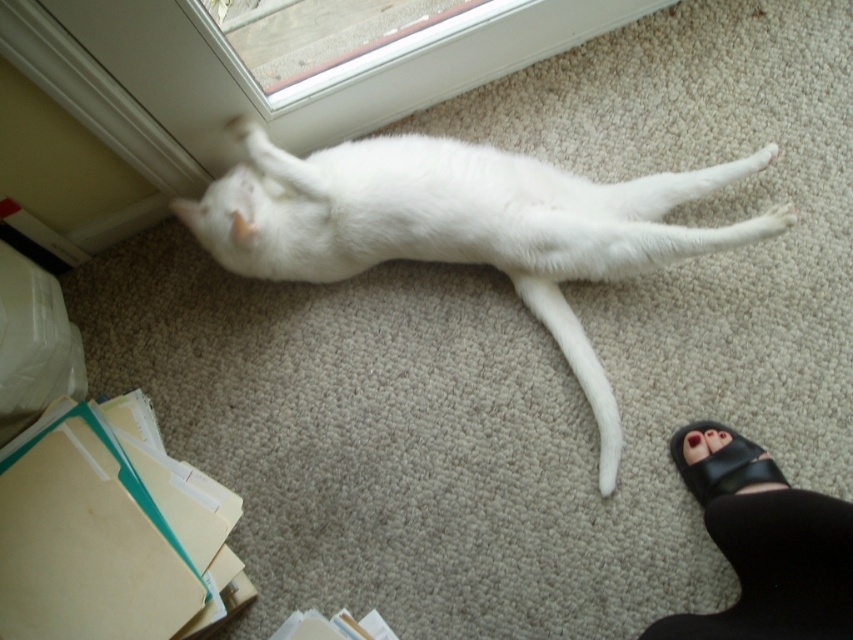
Is white fur cat at center smaller than black leather sandals at lower right?

No, white fur cat at center is not smaller than black leather sandals at lower right.

From the picture: Can you confirm if white fur cat at center is shorter than black leather sandals at lower right?

In fact, white fur cat at center may be taller than black leather sandals at lower right.

Is point (244, 216) behind point (778, 572)?

Yes.

Find the location of a particular element. The image size is (853, 640). white fur cat at center is located at coordinates (462, 227).

Between black leather sandals at lower right and black leather sandal at lower right, which one appears on the right side from the viewer's perspective?

From the viewer's perspective, black leather sandal at lower right appears more on the right side.

Does point (793, 538) come farther from viewer compared to point (706, 493)?

That is False.

Does point (689, 474) come behind point (715, 429)?

No.

At what (x,y) coordinates should I click in order to perform the action: click on black leather sandals at lower right. Please return your answer as a coordinate pair (x, y). Looking at the image, I should click on (763, 544).

Does white fur cat at center appear on the right side of black leather sandal at lower right?

In fact, white fur cat at center is to the left of black leather sandal at lower right.

Describe the element at coordinates (462, 227) in the screenshot. The image size is (853, 640). I see `white fur cat at center` at that location.

Identify the location of white fur cat at center. Image resolution: width=853 pixels, height=640 pixels. (462, 227).